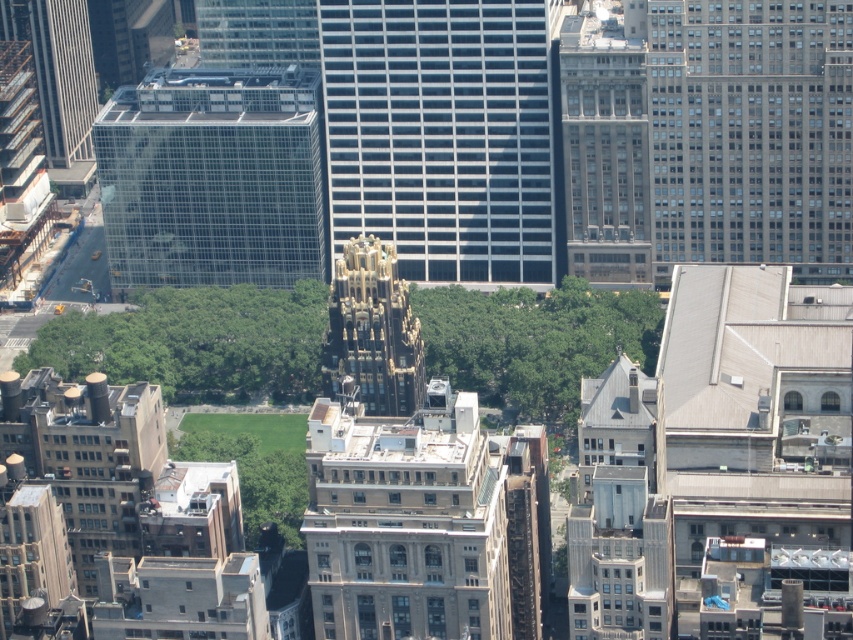
Who is more distant from viewer, (770, 145) or (270, 84)?

The point (770, 145) is more distant.

Can you confirm if gray concrete building at upper right is wider than transparent glass building at upper left?

No.

Which is in front, point (735, 253) or point (206, 256)?

Point (206, 256) is more forward.

I want to click on gray concrete building at upper right, so click(x=752, y=132).

Is transparent glass building at upper left behind gold textured building at center?

Yes, it is behind gold textured building at center.

Does transparent glass building at upper left appear under gold textured building at center?

No, transparent glass building at upper left is not below gold textured building at center.

Measure the distance between point (x=154, y=172) and camera.

They are 2160.21 feet apart.

Locate an element on the screen. transparent glass building at upper left is located at coordinates (x=213, y=177).

Which of these two, gray concrete building at upper right or gray stone building at center, stands shorter?

gray stone building at center is shorter.

Is gray concrete building at upper right smaller than gray stone building at center?

No, gray concrete building at upper right is not smaller than gray stone building at center.

Locate an element on the screen. The image size is (853, 640). gray concrete building at upper right is located at coordinates (752, 132).